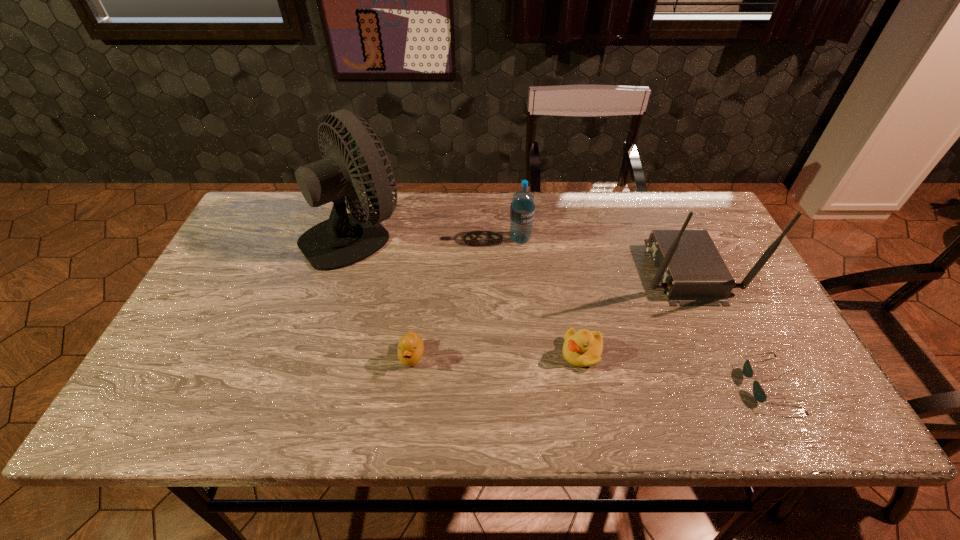
You are a GUI agent. You are given a task and a screenshot of the screen. Output one action in this format:
    pyautogui.click(x=<x>, y=<y>)
    Task: Click on the fan
    This screenshot has width=960, height=540.
    Given the screenshot: What is the action you would take?
    pyautogui.click(x=344, y=239)

Where is `the tallest object`? The image size is (960, 540). the tallest object is located at coordinates (344, 239).

Locate an element on the screen. The image size is (960, 540). the fifth shortest object is located at coordinates (693, 273).

At what (x,y) coordinates should I click in order to perform the action: click on the fourth shortest object. Please return your answer as a coordinate pair (x, y). Looking at the image, I should click on point(522,209).

The image size is (960, 540). Find the location of `water bottle`. water bottle is located at coordinates click(522, 209).

The image size is (960, 540). Find the location of `the fourth object from left to right`. the fourth object from left to right is located at coordinates (582, 348).

Where is `the left duckling`? the left duckling is located at coordinates (411, 346).

Identify the location of sunglasses. This screenshot has width=960, height=540. (759, 394).

Identify the location of vacant area located in front of the fan to direct airflow. (528, 234).

The width and height of the screenshot is (960, 540). I want to click on vacant point located on the back of the router to connect cables, so click(x=497, y=271).